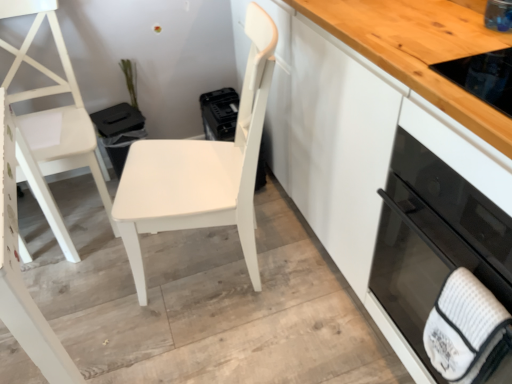
Question: Is white glossy cabinet at center situated inside black glass oven at right or outside?

Choices:
 (A) inside
 (B) outside

Answer: (B)

Question: In terms of size, does white glossy cabinet at center appear bigger or smaller than black glass oven at right?

Choices:
 (A) small
 (B) big

Answer: (B)

Question: Estimate the real-world distances between objects in this image. Which object is closer to the white textured hand towel at lower right?

Choices:
 (A) black glass oven at right
 (B) white matte chair at left, positioned as the 1th chair in left-to-right order
 (C) white glossy cabinet at center
 (D) white matte chair at center, which ranks as the 1th chair in right-to-left order

Answer: (A)

Question: Estimate the real-world distances between objects in this image. Which object is farther from the black glass oven at right?

Choices:
 (A) white textured hand towel at lower right
 (B) white matte chair at center, the second chair from the left
 (C) white glossy cabinet at center
 (D) white matte chair at left, positioned as the 1th chair in left-to-right order

Answer: (D)